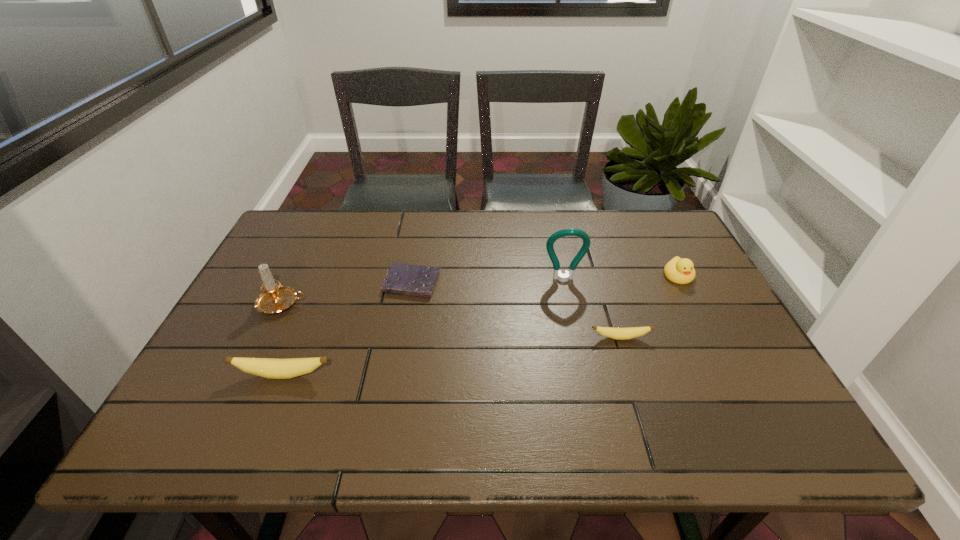
Locate an element on the screen. This screenshot has width=960, height=540. vacant space located on the left of the farther banana is located at coordinates (520, 338).

Locate an element on the screen. This screenshot has height=540, width=960. vacant space located at the jaws of the bottle opener is located at coordinates (571, 316).

You are a GUI agent. You are given a task and a screenshot of the screen. Output one action in this format:
    pyautogui.click(x=<x>, y=<y>)
    Task: Click on the vacant space located on the front of the second tallest object
    Image resolution: width=960 pixels, height=540 pixels.
    Given the screenshot: What is the action you would take?
    pyautogui.click(x=244, y=383)

Locate an element on the screen. The image size is (960, 540). free region located 0.230m on the front of the fourth object from right to left is located at coordinates (396, 369).

Find the location of a particular element. This screenshot has height=540, width=960. free space located 0.160m on the face of the duckling is located at coordinates pos(707,329).

Where is `object at the near edge`? This screenshot has height=540, width=960. object at the near edge is located at coordinates (271, 368).

This screenshot has height=540, width=960. Find the location of `banana that is at the left edge`. banana that is at the left edge is located at coordinates (271, 368).

Where is `candle that is at the left edge`? The image size is (960, 540). candle that is at the left edge is located at coordinates pyautogui.click(x=274, y=298).

Image resolution: width=960 pixels, height=540 pixels. What are the coordinates of `object located at the right edge` in the screenshot? It's located at (681, 271).

Image resolution: width=960 pixels, height=540 pixels. Find the location of `object that is positioned at the near left corner`. object that is positioned at the near left corner is located at coordinates (271, 368).